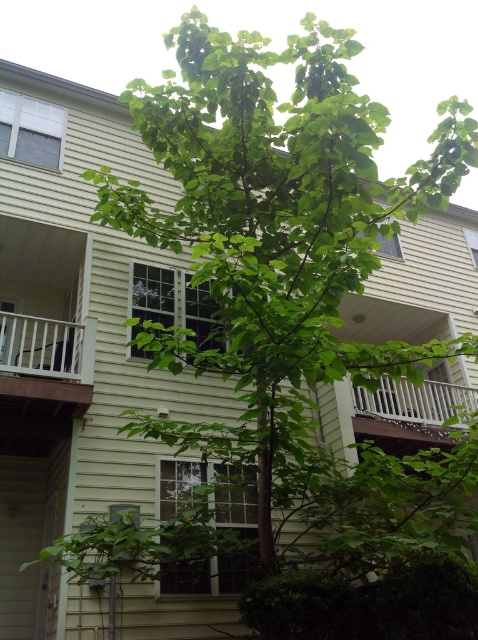
Does point (72, 376) lie in front of point (365, 406)?

Yes, it is.

Is white wooden railing at lower left below white wooden railing at lower right?

Incorrect, white wooden railing at lower left is not positioned below white wooden railing at lower right.

The height and width of the screenshot is (640, 478). Find the location of `white wooden railing at lower left`. white wooden railing at lower left is located at coordinates (46, 358).